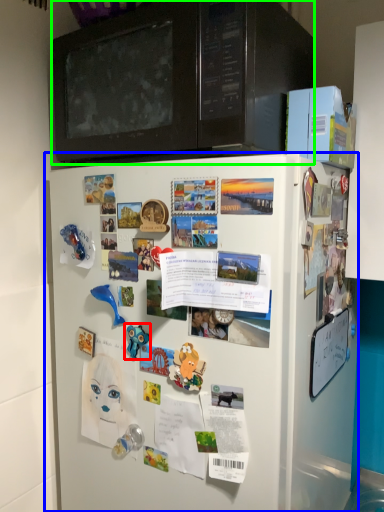
Question: Estimate the real-world distances between objects in this image. Which object is farther from toy (highlighted by a red box), refrigerator (highlighted by a blue box) or microwave oven (highlighted by a green box)?

Choices:
 (A) refrigerator
 (B) microwave oven

Answer: (B)